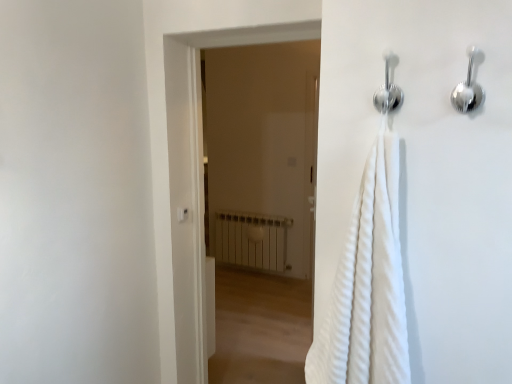
Question: Is white plastic light switch at upper center positioned behind satin silver shower at upper right, the 1th shower when ordered from right to left?

Choices:
 (A) no
 (B) yes

Answer: (B)

Question: From a real-world perspective, is white plastic light switch at upper center on satin silver shower at upper right, which appears as the second shower when viewed from the left?

Choices:
 (A) yes
 (B) no

Answer: (B)

Question: Considering the relative sizes of white plastic light switch at upper center and satin silver shower at upper right, which appears as the second shower when viewed from the left, in the image provided, is white plastic light switch at upper center smaller than satin silver shower at upper right, which appears as the second shower when viewed from the left,?

Choices:
 (A) no
 (B) yes

Answer: (B)

Question: Would you consider white plastic light switch at upper center to be distant from satin silver shower at upper right, which appears as the second shower when viewed from the left?

Choices:
 (A) no
 (B) yes

Answer: (B)

Question: Is white plastic light switch at upper center not within satin silver shower at upper right, the 1th shower when ordered from right to left?

Choices:
 (A) yes
 (B) no

Answer: (A)

Question: Is white plastic light switch at upper center situated inside satin silver shower at upper right, the 1th shower when ordered from right to left, or outside?

Choices:
 (A) outside
 (B) inside

Answer: (A)

Question: Is white plastic light switch at upper center to the left or to the right of satin silver shower at upper right, the 1th shower when ordered from right to left, in the image?

Choices:
 (A) left
 (B) right

Answer: (A)

Question: From the image's perspective, relative to satin silver shower at upper right, which appears as the second shower when viewed from the left, is white plastic light switch at upper center above or below?

Choices:
 (A) below
 (B) above

Answer: (A)

Question: Considering the positions of point (181, 216) and point (474, 59), is point (181, 216) closer or farther from the camera than point (474, 59)?

Choices:
 (A) farther
 (B) closer

Answer: (A)

Question: Visually, is white matte radiator at center positioned to the left or to the right of satin silver shower at upper right, the 1th shower when ordered from right to left?

Choices:
 (A) left
 (B) right

Answer: (A)

Question: In the image, is white matte radiator at center positioned in front of or behind satin silver shower at upper right, which appears as the second shower when viewed from the left?

Choices:
 (A) front
 (B) behind

Answer: (B)

Question: Would you say white matte radiator at center is inside or outside satin silver shower at upper right, the 1th shower when ordered from right to left?

Choices:
 (A) outside
 (B) inside

Answer: (A)

Question: Is point pyautogui.click(x=253, y=246) closer or farther from the camera than point pyautogui.click(x=474, y=59)?

Choices:
 (A) farther
 (B) closer

Answer: (A)

Question: From a real-world perspective, is chrome metallic shower at upper center, the first shower from the left, physically located above or below satin silver shower at upper right, which appears as the second shower when viewed from the left?

Choices:
 (A) below
 (B) above

Answer: (B)

Question: Considering the positions of chrome metallic shower at upper center, the first shower from the left, and satin silver shower at upper right, the 1th shower when ordered from right to left, in the image, is chrome metallic shower at upper center, the first shower from the left, bigger or smaller than satin silver shower at upper right, the 1th shower when ordered from right to left,?

Choices:
 (A) small
 (B) big

Answer: (A)